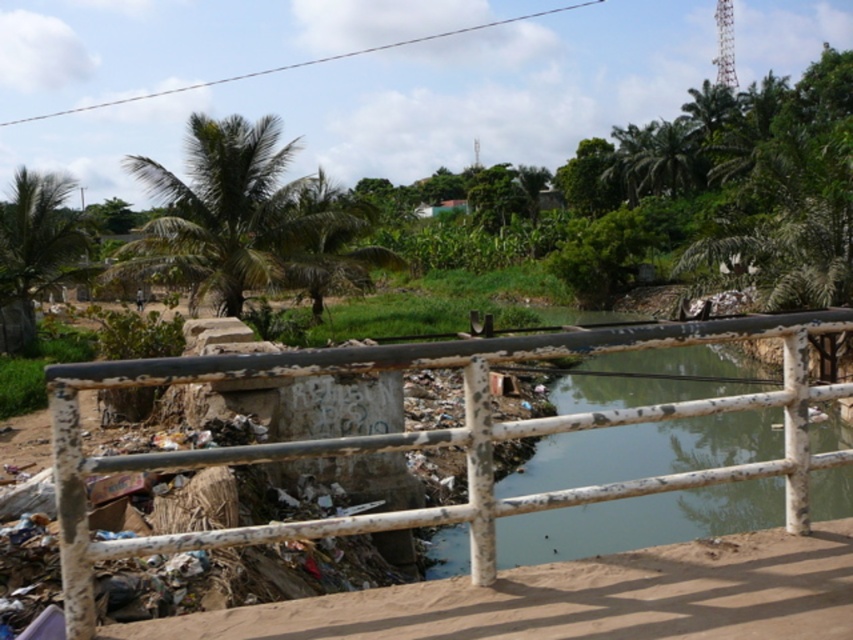
Question: Which point appears closest to the camera in this image?

Choices:
 (A) (148, 552)
 (B) (321, 209)
 (C) (16, 248)

Answer: (A)

Question: Which point is farther to the camera?

Choices:
 (A) green leafy palm tree at center
 (B) green leafy palm tree at upper left

Answer: (A)

Question: Does white painted metal rail at center come behind green leafy palm tree at upper left?

Choices:
 (A) no
 (B) yes

Answer: (A)

Question: Does green leafy palm tree at upper left lie behind green leafy palm tree at center?

Choices:
 (A) yes
 (B) no

Answer: (B)

Question: Does green leafy palm tree at upper center appear under green leafy palm tree at upper left?

Choices:
 (A) no
 (B) yes

Answer: (A)

Question: Which object is farther from the camera taking this photo?

Choices:
 (A) green leafy palm tree at upper left
 (B) green leafy palm tree at upper center
 (C) white painted metal rail at center

Answer: (B)